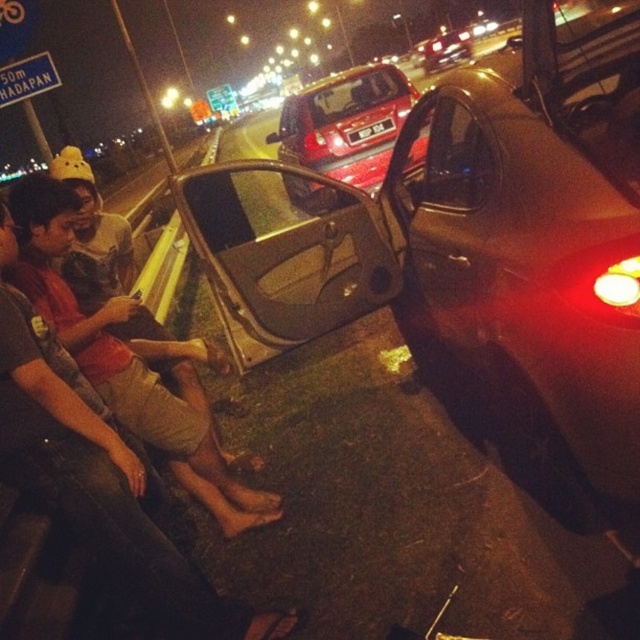
You are a driver who needs to park your car in a tight parking spot. You see the metallic silver car at center and the shiny red car at center in the image. Which car would be easier to fit into a small parking space?

The metallic silver car at center occupies less space than the shiny red car at center, so it would be easier to fit into a small parking space.

You are a pedestrian standing on the sidewalk and see both the shiny red car at center and the glossy red car at center. Which car is positioned more to the left side?

The shiny red car at center is positioned more to the left side than the glossy red car at center.

From the picture: You are a pedestrian trying to cross the road at night. You see the shiny red car at center and the blue plastic sign at upper left. Which object is closer to the ground?

The blue plastic sign at upper left is closer to the ground because the shiny red car at center is taller than it.